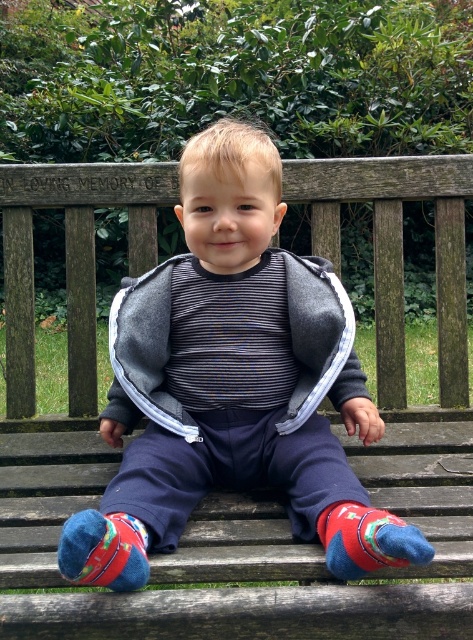
Does matte gray vest at center have a lesser width compared to multicolored felt sock at lower left?

No.

Is point (187, 227) closer to camera compared to point (146, 547)?

That is False.

Describe the element at coordinates (247, 372) in the screenshot. The image size is (473, 640). I see `matte gray vest at center` at that location.

At what (x,y) coordinates should I click in order to perform the action: click on matte gray vest at center. Please return your answer as a coordinate pair (x, y). This screenshot has height=640, width=473. Looking at the image, I should click on (247, 372).

Which is above, matte gray vest at center or red matte sock at lower right?

matte gray vest at center is above.

Does matte gray vest at center appear on the left side of red matte sock at lower right?

Correct, you'll find matte gray vest at center to the left of red matte sock at lower right.

At what (x,y) coordinates should I click in order to perform the action: click on matte gray vest at center. Please return your answer as a coordinate pair (x, y). Image resolution: width=473 pixels, height=640 pixels. Looking at the image, I should click on (247, 372).

From the picture: Who is shorter, red matte sock at lower right or multicolored felt sock at lower left?

With less height is red matte sock at lower right.

What do you see at coordinates (368, 540) in the screenshot? This screenshot has width=473, height=640. I see `red matte sock at lower right` at bounding box center [368, 540].

In order to click on red matte sock at lower right in this screenshot , I will do `click(368, 540)`.

The width and height of the screenshot is (473, 640). I want to click on red matte sock at lower right, so click(368, 540).